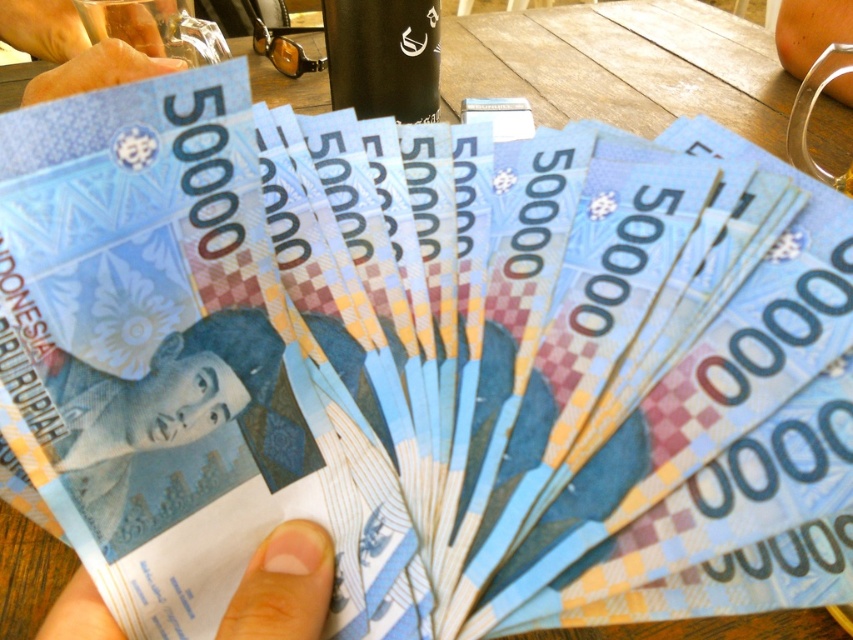
Question: Does white matte paper at lower center appear over matte plastic hand at upper left?

Choices:
 (A) no
 (B) yes

Answer: (A)

Question: From the image, what is the correct spatial relationship of white matte paper at lower center in relation to matte plastic hand at upper left?

Choices:
 (A) below
 (B) above

Answer: (A)

Question: Estimate the real-world distances between objects in this image. Which object is farther from the matte blue paper money at upper left?

Choices:
 (A) white matte paper at lower center
 (B) matte plastic hand at upper left

Answer: (A)

Question: Can you confirm if white matte paper at lower center is positioned below matte blue paper money at upper left?

Choices:
 (A) no
 (B) yes

Answer: (B)

Question: Which object is the closest to the matte blue paper money at upper left?

Choices:
 (A) white matte paper at lower center
 (B) matte plastic hand at upper left

Answer: (B)

Question: Which object appears closest to the camera in this image?

Choices:
 (A) matte blue paper money at upper left
 (B) matte plastic hand at upper left

Answer: (A)